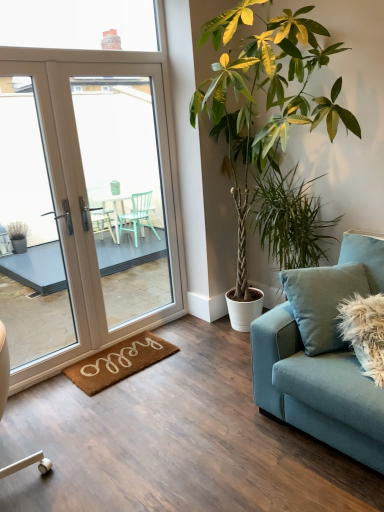
The width and height of the screenshot is (384, 512). What do you see at coordinates (124, 193) in the screenshot?
I see `white glossy door at left` at bounding box center [124, 193].

What do you see at coordinates (267, 119) in the screenshot? I see `green leafy plant at center, the first houseplant viewed from the left` at bounding box center [267, 119].

What do you see at coordinates (119, 362) in the screenshot? I see `brown coir mat at lower left` at bounding box center [119, 362].

In order to click on white glossy door at left in this screenshot , I will do `click(124, 193)`.

Is point (126, 246) positioned in front of point (79, 92)?

Yes, point (126, 246) is closer to viewer.

From a real-world perspective, between white glossy door at left and white glossy door at left, who is vertically higher?

From a 3D spatial view, white glossy door at left is above.

Looking at the image, does white glossy door at left seem bigger or smaller compared to white glossy door at left?

white glossy door at left is bigger than white glossy door at left.

In the scene shown: Is brown coir mat at lower left smaller than green leafy plant at center, the 2th houseplant when ordered from left to right?

Correct, brown coir mat at lower left occupies less space than green leafy plant at center, the 2th houseplant when ordered from left to right.

Which is closer to the camera, (x=155, y=357) or (x=293, y=176)?

Point (x=155, y=357) is closer to the camera than point (x=293, y=176).

Is brown coir mat at lower left not inside green leafy plant at center, the first houseplant in the right-to-left sequence?

Yes, brown coir mat at lower left is outside of green leafy plant at center, the first houseplant in the right-to-left sequence.

Is brown coir mat at lower left to the right of green leafy plant at center, the 2th houseplant when ordered from left to right, from the viewer's perspective?

In fact, brown coir mat at lower left is to the left of green leafy plant at center, the 2th houseplant when ordered from left to right.

Is point (281, 118) behind point (91, 373)?

No, it is not.

Between green leafy plant at center, the first houseplant viewed from the left, and brown coir mat at lower left, which one has smaller size?

brown coir mat at lower left.

Is green leafy plant at center, which appears as the second houseplant when viewed from the right, outside of brown coir mat at lower left?

That's correct, green leafy plant at center, which appears as the second houseplant when viewed from the right, is outside of brown coir mat at lower left.

Considering the relative positions of green leafy plant at center, which appears as the second houseplant when viewed from the right, and brown coir mat at lower left in the image provided, is green leafy plant at center, which appears as the second houseplant when viewed from the right, to the left of brown coir mat at lower left from the viewer's perspective?

No.

Based on the photo, is white glossy door at left oriented towards green leafy plant at center, the first houseplant in the right-to-left sequence?

Yes, white glossy door at left is oriented towards green leafy plant at center, the first houseplant in the right-to-left sequence.

Would you say white glossy door at left is to the left or to the right of green leafy plant at center, the first houseplant in the right-to-left sequence, in the picture?

white glossy door at left is to the left of green leafy plant at center, the first houseplant in the right-to-left sequence.

Is white glossy door at left beside green leafy plant at center, the first houseplant in the right-to-left sequence?

No, white glossy door at left is not with green leafy plant at center, the first houseplant in the right-to-left sequence.

Looking at this image, from a real-world perspective, is white glossy door at left over green leafy plant at center, the 2th houseplant when ordered from left to right?

Yes, from a real-world perspective, white glossy door at left is on top of green leafy plant at center, the 2th houseplant when ordered from left to right.

In terms of size, does green leafy plant at center, the 2th houseplant when ordered from left to right, appear bigger or smaller than green leafy plant at center, which appears as the second houseplant when viewed from the right?

green leafy plant at center, the 2th houseplant when ordered from left to right, is smaller than green leafy plant at center, which appears as the second houseplant when viewed from the right.

Considering the sizes of objects green leafy plant at center, the 2th houseplant when ordered from left to right, and green leafy plant at center, which appears as the second houseplant when viewed from the right, in the image provided, who is taller, green leafy plant at center, the 2th houseplant when ordered from left to right, or green leafy plant at center, which appears as the second houseplant when viewed from the right,?

green leafy plant at center, which appears as the second houseplant when viewed from the right.

Which is behind, green leafy plant at center, the 2th houseplant when ordered from left to right, or green leafy plant at center, the first houseplant viewed from the left?

green leafy plant at center, the 2th houseplant when ordered from left to right, is more distant.

What's the angular difference between green leafy plant at center, the 2th houseplant when ordered from left to right, and green leafy plant at center, which appears as the second houseplant when viewed from the right,'s facing directions?

0.334 degrees.

Is point (122, 187) behind point (332, 357)?

Yes, point (122, 187) is behind point (332, 357).

Who is shorter, white glossy door at left or teal fabric couch at right?

With less height is teal fabric couch at right.

Based on the photo, is teal fabric couch at right at the back of white glossy door at left?

white glossy door at left does not have its back to teal fabric couch at right.

I want to click on door on the left of the teal fabric couch at right, so click(86, 208).

Which object is further away from the camera, green leafy plant at center, the 2th houseplant when ordered from left to right, or white glossy door at left?

white glossy door at left.

From the picture: From the image's perspective, is green leafy plant at center, the first houseplant in the right-to-left sequence, located above white glossy door at left?

No, from the image's perspective, green leafy plant at center, the first houseplant in the right-to-left sequence, is not over white glossy door at left.

Is green leafy plant at center, the first houseplant in the right-to-left sequence, not within white glossy door at left?

green leafy plant at center, the first houseplant in the right-to-left sequence, is positioned outside white glossy door at left.

Where is `door below the white glossy door at left (from the image's perspective)`? door below the white glossy door at left (from the image's perspective) is located at coordinates (86, 208).

Locate an element on the screen. Image resolution: width=384 pixels, height=512 pixels. houseplant that is the 1st object located in front of the brown coir mat at lower left is located at coordinates (290, 220).

From the image, which object appears to be nearer to transparent glass window at upper center, green leafy plant at center, the 2th houseplant when ordered from left to right, or green leafy plant at center, the first houseplant viewed from the left?

green leafy plant at center, the first houseplant viewed from the left.

Estimate the real-world distances between objects in this image. Which object is further from green leafy plant at center, the first houseplant viewed from the left, white glossy door at left or brown coir mat at lower left?

brown coir mat at lower left.

Which object lies nearer to the anchor point white glossy door at left, green leafy plant at center, the 2th houseplant when ordered from left to right, or teal fabric couch at right?

green leafy plant at center, the 2th houseplant when ordered from left to right, is closer to white glossy door at left.

Based on their spatial positions, is white glossy door at left or white glossy door at left closer to teal fabric couch at right?

The object closer to teal fabric couch at right is white glossy door at left.

Considering their positions, is white glossy door at left positioned closer to transparent glass window at upper center than teal fabric couch at right?

white glossy door at left.

Looking at the image, which one is located further to brown coir mat at lower left, green leafy plant at center, the first houseplant in the right-to-left sequence, or green leafy plant at center, which appears as the second houseplant when viewed from the right?

green leafy plant at center, which appears as the second houseplant when viewed from the right.

Looking at the image, which one is located further to white glossy door at left, teal fabric couch at right or brown coir mat at lower left?

teal fabric couch at right is further to white glossy door at left.

Which object lies further to the anchor point white glossy door at left, transparent glass window at upper center or teal fabric couch at right?

The object further to white glossy door at left is teal fabric couch at right.

Find the location of a particular element. door between transparent glass window at upper center and teal fabric couch at right in the vertical direction is located at coordinates (86, 208).

Locate an element on the screen. studio couch between transparent glass window at upper center and brown coir mat at lower left from top to bottom is located at coordinates (316, 389).

At what (x,y) coordinates should I click in order to perform the action: click on houseplant located between white glossy door at left and green leafy plant at center, the 2th houseplant when ordered from left to right, in the left-right direction. Please return your answer as a coordinate pair (x, y). The width and height of the screenshot is (384, 512). Looking at the image, I should click on (267, 119).

At what (x,y) coordinates should I click in order to perform the action: click on screen door between white glossy door at left and green leafy plant at center, the first houseplant viewed from the left. Please return your answer as a coordinate pair (x, y). This screenshot has height=512, width=384. Looking at the image, I should click on (124, 193).